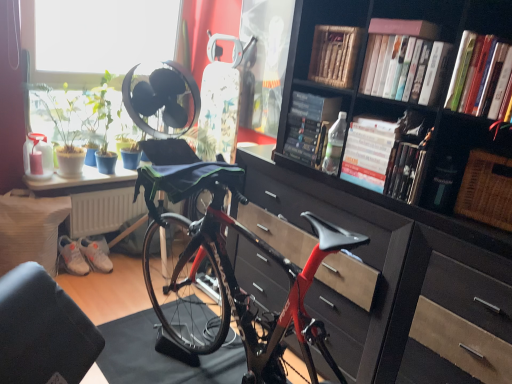
Question: Does white matte book at upper center, placed as the 2th book when sorted from front to back, have a greater width compared to hardcover book at center, acting as the fourth book starting from the front?

Choices:
 (A) yes
 (B) no

Answer: (B)

Question: Is white matte book at upper center, the sixth book positioned from the back, oriented towards hardcover book at center, acting as the fourth book starting from the front?

Choices:
 (A) yes
 (B) no

Answer: (B)

Question: Is white matte book at upper center, placed as the 2th book when sorted from front to back, beside hardcover book at center, which ranks as the fourth book in back-to-front order?

Choices:
 (A) yes
 (B) no

Answer: (B)

Question: Is the position of white matte book at upper center, the sixth book positioned from the back, more distant than that of hardcover book at center, which ranks as the fourth book in back-to-front order?

Choices:
 (A) no
 (B) yes

Answer: (A)

Question: Is white matte book at upper center, the sixth book positioned from the back, bigger than hardcover book at center, which ranks as the fourth book in back-to-front order?

Choices:
 (A) no
 (B) yes

Answer: (B)

Question: From a real-world perspective, is white matte sneakers at lower left, arranged as the second sneakers when viewed from the right, physically located above or below wooden book at upper center, which appears as the sixth book when viewed from the front?

Choices:
 (A) below
 (B) above

Answer: (A)

Question: From their relative heights in the image, would you say white matte sneakers at lower left, arranged as the second sneakers when viewed from the right, is taller or shorter than wooden book at upper center, which appears as the sixth book when viewed from the front?

Choices:
 (A) short
 (B) tall

Answer: (A)

Question: Considering the positions of white matte sneakers at lower left, arranged as the second sneakers when viewed from the right, and wooden book at upper center, which appears as the sixth book when viewed from the front, in the image, is white matte sneakers at lower left, arranged as the second sneakers when viewed from the right, wider or thinner than wooden book at upper center, which appears as the sixth book when viewed from the front,?

Choices:
 (A) wide
 (B) thin

Answer: (B)

Question: Is white matte sneakers at lower left, arranged as the second sneakers when viewed from the right, to the left or to the right of wooden book at upper center, positioned as the second book in back-to-front order, in the image?

Choices:
 (A) left
 (B) right

Answer: (A)

Question: From the image's perspective, relative to white matte book at upper center, the sixth book positioned from the back, is wooden book at upper center, positioned as the second book in back-to-front order, above or below?

Choices:
 (A) above
 (B) below

Answer: (A)

Question: Considering the positions of wooden book at upper center, positioned as the second book in back-to-front order, and white matte book at upper center, the sixth book positioned from the back, in the image, is wooden book at upper center, positioned as the second book in back-to-front order, bigger or smaller than white matte book at upper center, the sixth book positioned from the back,?

Choices:
 (A) big
 (B) small

Answer: (A)

Question: Is point (320, 41) positioned closer to the camera than point (394, 77)?

Choices:
 (A) farther
 (B) closer

Answer: (A)

Question: Looking at their shapes, would you say wooden book at upper center, which appears as the sixth book when viewed from the front, is wider or thinner than white matte book at upper center, placed as the 2th book when sorted from front to back?

Choices:
 (A) thin
 (B) wide

Answer: (B)

Question: In terms of size, does woven brown picnic basket at right appear bigger or smaller than hardcover book at upper right, which appears as the 1th book when viewed from the front?

Choices:
 (A) big
 (B) small

Answer: (A)

Question: In terms of width, does woven brown picnic basket at right look wider or thinner when compared to hardcover book at upper right, which is the seventh book from back to front?

Choices:
 (A) wide
 (B) thin

Answer: (A)